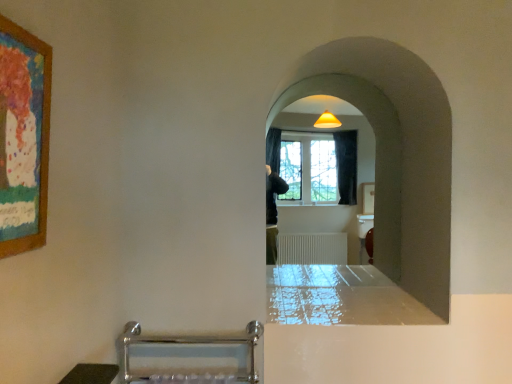
The width and height of the screenshot is (512, 384). In order to click on white matte wall at center in this screenshot , I will do `click(396, 154)`.

Locate an element on the screen. This screenshot has width=512, height=384. wooden painted picture frame at upper left is located at coordinates (24, 136).

Is white matte wall at center to the left of glossy white counter top at center from the viewer's perspective?

Yes.

Would you say white matte wall at center is outside glossy white counter top at center?

white matte wall at center lies outside glossy white counter top at center's area.

Considering the positions of point (36, 189) and point (380, 60), is point (36, 189) closer or farther from the camera than point (380, 60)?

Point (36, 189) is positioned closer to the camera compared to point (380, 60).

This screenshot has width=512, height=384. What are the coordinates of `picture frame on the left of white matte wall at center` in the screenshot? It's located at (24, 136).

From the image's perspective, is wooden painted picture frame at upper left under white matte wall at center?

No, from the image's perspective, wooden painted picture frame at upper left is not below white matte wall at center.

What's the angular difference between glossy white counter top at center and white matte wall at center's facing directions?

The angle between the facing direction of glossy white counter top at center and the facing direction of white matte wall at center is 0.000481 degrees.

Which is more to the right, glossy white counter top at center or white matte wall at center?

glossy white counter top at center.

Does glossy white counter top at center turn towards white matte wall at center?

Yes.

From the image's perspective, relative to white matte wall at center, is glossy white counter top at center above or below?

glossy white counter top at center is below white matte wall at center.

Is wooden painted picture frame at upper left at the back of glossy white counter top at center?

No, glossy white counter top at center is not facing the opposite direction of wooden painted picture frame at upper left.

In the image, is glossy white counter top at center on the left side or the right side of wooden painted picture frame at upper left?

Based on their positions, glossy white counter top at center is located to the right of wooden painted picture frame at upper left.

Are glossy white counter top at center and wooden painted picture frame at upper left making contact?

No, glossy white counter top at center is not touching wooden painted picture frame at upper left.

Is glossy white counter top at center bigger or smaller than wooden painted picture frame at upper left?

Clearly, glossy white counter top at center is larger in size than wooden painted picture frame at upper left.

Which object is further away from the camera taking this photo, wooden painted picture frame at upper left or glossy white counter top at center?

glossy white counter top at center is further away from the camera.

Is glossy white counter top at center at the back of wooden painted picture frame at upper left?

No, glossy white counter top at center is not at the back of wooden painted picture frame at upper left.

Looking at the image, does wooden painted picture frame at upper left seem bigger or smaller compared to glossy white counter top at center?

Clearly, wooden painted picture frame at upper left is smaller in size than glossy white counter top at center.

Is white matte wall at center facing away from wooden painted picture frame at upper left?

That's not correct — white matte wall at center is not looking away from wooden painted picture frame at upper left.

Find the location of a particular element. This screenshot has width=512, height=384. picture frame located above the white matte wall at center (from a real-world perspective) is located at coordinates (24, 136).

Which of these two, white matte wall at center or wooden painted picture frame at upper left, stands taller?

white matte wall at center.

Would you say white matte wall at center contains wooden painted picture frame at upper left?

That's incorrect, wooden painted picture frame at upper left is not inside white matte wall at center.

The height and width of the screenshot is (384, 512). In order to click on counter top below the white matte wall at center (from a real-world perspective) in this screenshot , I will do `click(340, 297)`.

Locate an element on the screen. The image size is (512, 384). passage behind the wooden painted picture frame at upper left is located at coordinates (396, 154).

Which object lies further to the anchor point glossy white counter top at center, wooden painted picture frame at upper left or white matte wall at center?

Based on the image, wooden painted picture frame at upper left appears to be further to glossy white counter top at center.

Looking at the image, which one is located closer to white matte wall at center, glossy white counter top at center or wooden painted picture frame at upper left?

glossy white counter top at center lies closer to white matte wall at center than the other object.

From the image, which object appears to be farther from white matte wall at center, wooden painted picture frame at upper left or glossy white counter top at center?

Among the two, wooden painted picture frame at upper left is located further to white matte wall at center.

From the picture: Considering their positions, is glossy white counter top at center positioned closer to wooden painted picture frame at upper left than white matte wall at center?

glossy white counter top at center lies closer to wooden painted picture frame at upper left than the other object.

Which object lies further to the anchor point glossy white counter top at center, white matte wall at center or wooden painted picture frame at upper left?

wooden painted picture frame at upper left is further to glossy white counter top at center.

When comparing their distances from wooden painted picture frame at upper left, does white matte wall at center or glossy white counter top at center seem further?

white matte wall at center.

In order to click on passage between wooden painted picture frame at upper left and glossy white counter top at center in this screenshot , I will do `click(396, 154)`.